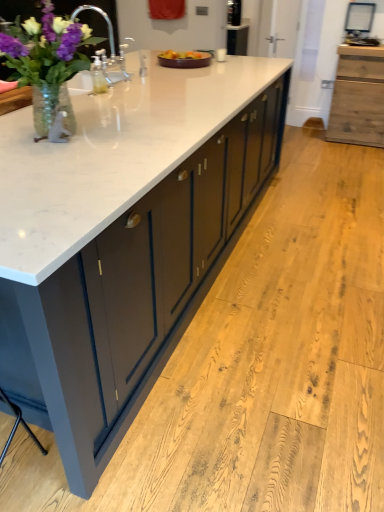
Question: From the image's perspective, is wooden cabinet at right on top of brown ceramic tray at center?

Choices:
 (A) no
 (B) yes

Answer: (B)

Question: Considering the relative positions of wooden cabinet at right and brown ceramic tray at center in the image provided, is wooden cabinet at right behind brown ceramic tray at center?

Choices:
 (A) yes
 (B) no

Answer: (A)

Question: From a real-world perspective, is wooden cabinet at right under brown ceramic tray at center?

Choices:
 (A) yes
 (B) no

Answer: (A)

Question: Does wooden cabinet at right appear on the right side of brown ceramic tray at center?

Choices:
 (A) yes
 (B) no

Answer: (A)

Question: Is brown ceramic tray at center a part of wooden cabinet at right?

Choices:
 (A) no
 (B) yes

Answer: (A)

Question: Is wooden cabinet at right far away from brown ceramic tray at center?

Choices:
 (A) no
 (B) yes

Answer: (B)

Question: Does white marble countertop at center have a lesser width compared to clear glass vase at left?

Choices:
 (A) no
 (B) yes

Answer: (A)

Question: From a real-world perspective, is white marble countertop at center on clear glass vase at left?

Choices:
 (A) yes
 (B) no

Answer: (B)

Question: Considering the relative sizes of white marble countertop at center and clear glass vase at left in the image provided, is white marble countertop at center bigger than clear glass vase at left?

Choices:
 (A) yes
 (B) no

Answer: (A)

Question: Is white marble countertop at center turned away from clear glass vase at left?

Choices:
 (A) yes
 (B) no

Answer: (B)

Question: Does white marble countertop at center come behind clear glass vase at left?

Choices:
 (A) no
 (B) yes

Answer: (A)

Question: Is white marble countertop at center taller than clear glass vase at left?

Choices:
 (A) no
 (B) yes

Answer: (B)

Question: From a real-world perspective, is brown ceramic tray at center physically above white glossy sink at upper left?

Choices:
 (A) yes
 (B) no

Answer: (B)